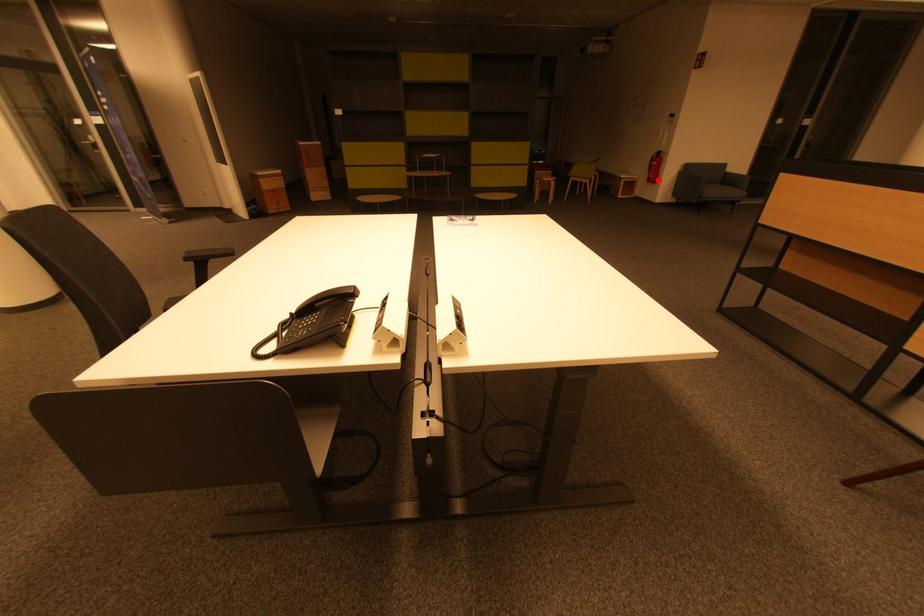
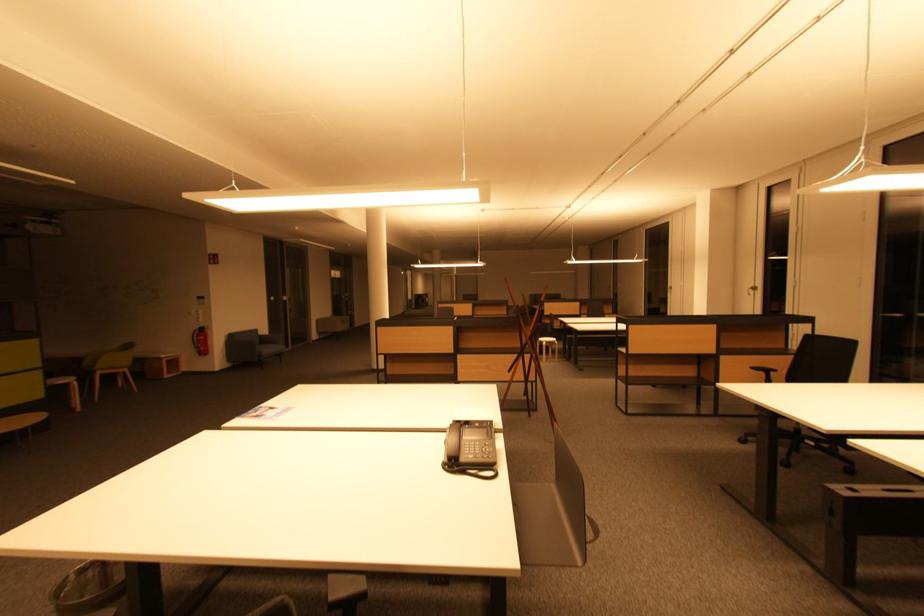
Question: I am providing you with two images of the same scene from different viewpoints. A red point is shown in image1. For the corresponding object point in image2, is it positioned nearer or farther from the camera?

Choices:
 (A) Nearer
 (B) Farther

Answer: (B)